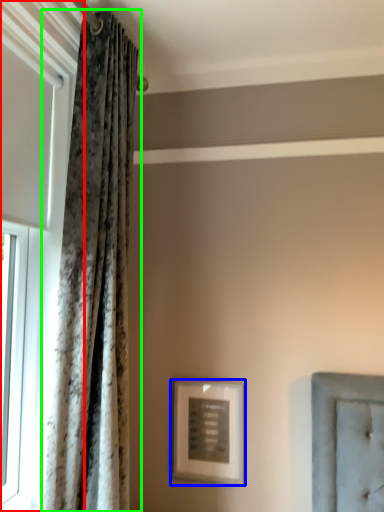
Question: Estimate the real-world distances between objects in this image. Which object is farther from window (highlighted by a red box), picture frame (highlighted by a blue box) or curtain (highlighted by a green box)?

Choices:
 (A) picture frame
 (B) curtain

Answer: (A)